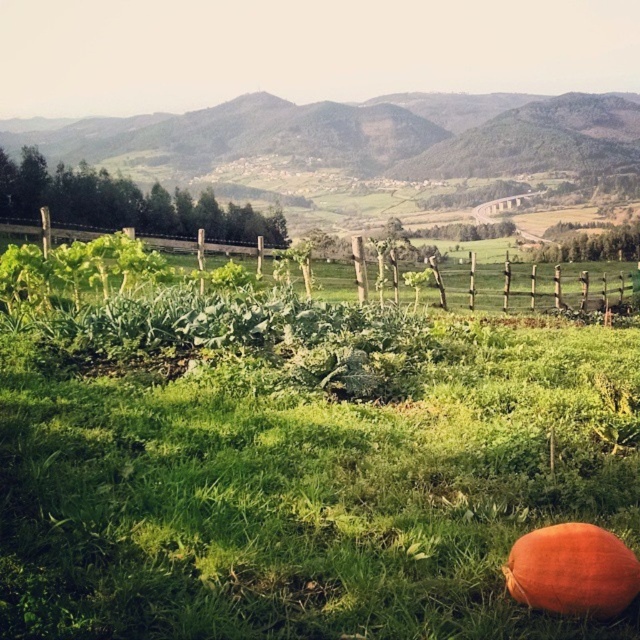
In the scene shown: Can you confirm if green grassy at center is positioned to the left of orange matte pumpkin at lower right?

Indeed, green grassy at center is positioned on the left side of orange matte pumpkin at lower right.

This screenshot has width=640, height=640. In order to click on green grassy at center in this screenshot , I will do `click(300, 468)`.

Locate an element on the screen. The width and height of the screenshot is (640, 640). green grassy at center is located at coordinates (300, 468).

Is orange matte pumpkin at lower right to the right of wooden posts at center from the viewer's perspective?

Correct, you'll find orange matte pumpkin at lower right to the right of wooden posts at center.

Does orange matte pumpkin at lower right have a lesser width compared to wooden posts at center?

Yes, orange matte pumpkin at lower right is thinner than wooden posts at center.

You are a GUI agent. You are given a task and a screenshot of the screen. Output one action in this format:
    pyautogui.click(x=<x>, y=<y>)
    Task: Click on the orange matte pumpkin at lower right
    
    Given the screenshot: What is the action you would take?
    pyautogui.click(x=572, y=570)

Where is `orange matte pumpkin at lower right`? Image resolution: width=640 pixels, height=640 pixels. orange matte pumpkin at lower right is located at coordinates (572, 570).

Does green grassy at center have a smaller size compared to green grassy hillside at center?

Yes, green grassy at center is smaller than green grassy hillside at center.

Is point (256, 560) closer to camera compared to point (316, 182)?

Yes, it is in front of point (316, 182).

Does point (48, 621) come behind point (253, 198)?

No, (48, 621) is closer to viewer.

This screenshot has height=640, width=640. Identify the location of green grassy at center. (300, 468).